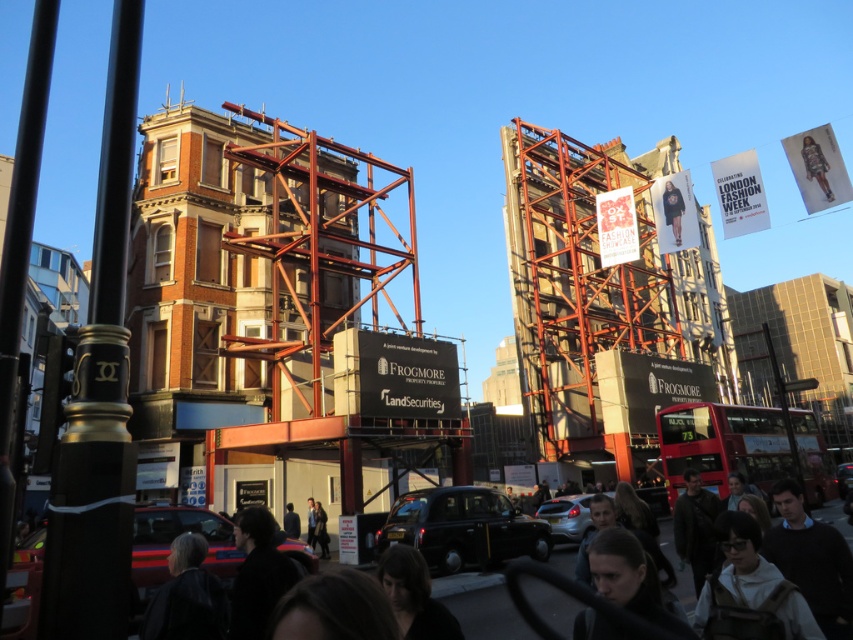
Looking at this image, can you confirm if black polished metal pole at left is wider than red metallic bus at center?

In fact, black polished metal pole at left might be narrower than red metallic bus at center.

Is point (111, 148) positioned in front of point (677, 460)?

Yes, point (111, 148) is in front of point (677, 460).

Image resolution: width=853 pixels, height=640 pixels. What are the coordinates of `black polished metal pole at left` in the screenshot? It's located at (99, 394).

Who is more distant from viewer, (708, 420) or (685, 596)?

The point (708, 420) is behind.

Is red metallic bus at center wider than dark hair at lower center?

In fact, red metallic bus at center might be narrower than dark hair at lower center.

Is point (677, 458) behind point (682, 580)?

Yes, it is.

Find the location of `red metallic bus at center`. red metallic bus at center is located at coordinates (722, 444).

Is black polished metal pole at left closer to the viewer compared to dark hair at lower center?

Yes, it is in front of dark hair at lower center.

Who is more distant from viewer, (57, 632) or (556, 563)?

Positioned behind is point (556, 563).

Is point (57, 515) closer to camera compared to point (448, 584)?

Yes, it is in front of point (448, 584).

This screenshot has width=853, height=640. Identify the location of black polished metal pole at left. (99, 394).